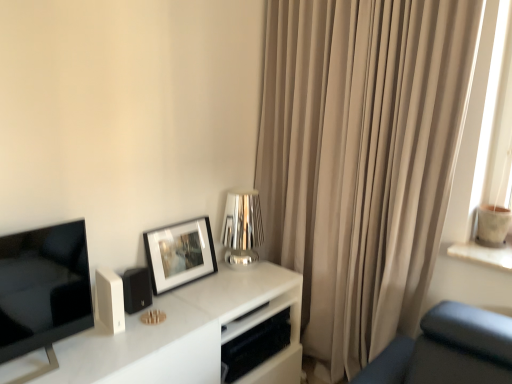
What are the coordinates of `unoccupied region to the right of white plastic speaker at lower left` in the screenshot? It's located at (151, 333).